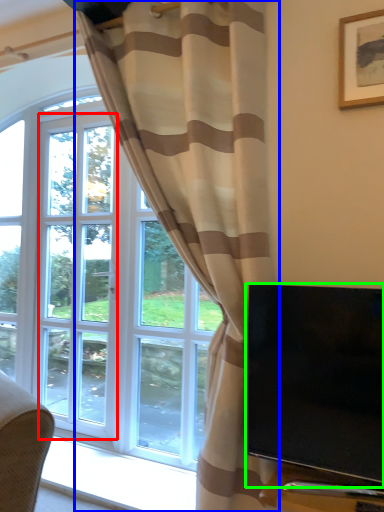
Question: Which is nearer to the screen door (highlighted by a red box)? curtain (highlighted by a blue box) or television (highlighted by a green box).

Choices:
 (A) curtain
 (B) television

Answer: (A)